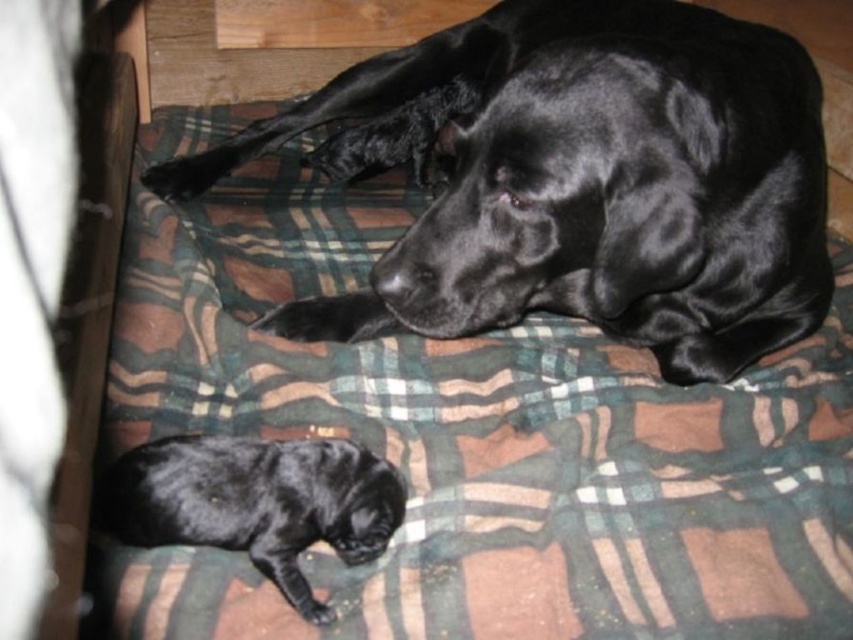
At what (x,y) coordinates should I click in order to perform the action: click on shiny black dog at center. Please return your answer as a coordinate pair (x, y). This screenshot has height=640, width=853. Looking at the image, I should click on (578, 180).

How far apart are shiny black dog at center and shiny black puppy at lower left?

shiny black dog at center and shiny black puppy at lower left are 16.82 inches apart from each other.

Which is behind, point (505, 4) or point (334, 458)?

The point (505, 4) is more distant.

What are the coordinates of `shiny black dog at center` in the screenshot? It's located at (578, 180).